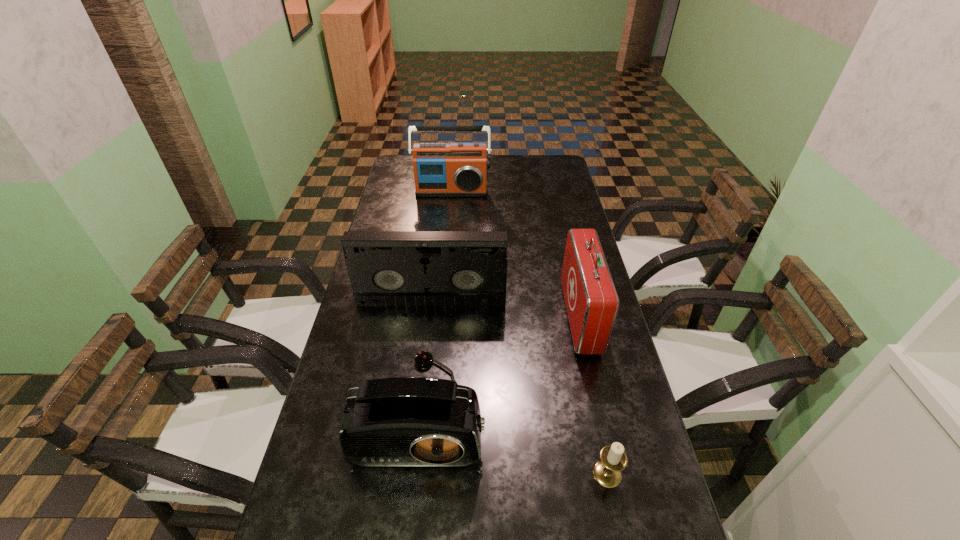
Identify the location of the farthest object. The image size is (960, 540). (457, 169).

The height and width of the screenshot is (540, 960). I want to click on the farther radio receiver, so click(x=457, y=169).

Find the location of a particular element. the first-aid kit is located at coordinates (591, 299).

Where is `videotape`? This screenshot has height=540, width=960. videotape is located at coordinates (386, 268).

This screenshot has height=540, width=960. What are the coordinates of `the shorter radio receiver` in the screenshot? It's located at (404, 421).

Where is `the shortest object`? the shortest object is located at coordinates (607, 472).

Image resolution: width=960 pixels, height=540 pixels. In order to click on free region located on the front-facing side of the farthest object in this screenshot , I will do `click(449, 224)`.

Find the location of `free space located 0.170m on the side of the first-aid kit with the first aid cross symbol`. free space located 0.170m on the side of the first-aid kit with the first aid cross symbol is located at coordinates (510, 317).

Where is `vacant space situated 0.200m on the side of the first-aid kit with the first aid cross symbol`? The height and width of the screenshot is (540, 960). vacant space situated 0.200m on the side of the first-aid kit with the first aid cross symbol is located at coordinates (500, 317).

Where is `vacant space located on the side of the first-aid kit with the first aid cross symbol`? This screenshot has width=960, height=540. vacant space located on the side of the first-aid kit with the first aid cross symbol is located at coordinates (534, 317).